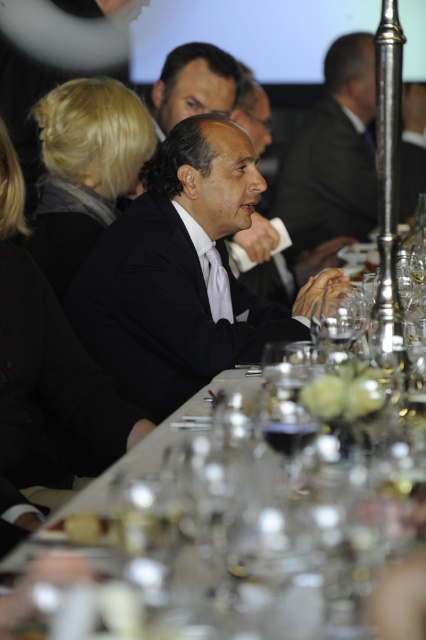
You are attending a formal event and notice two points on the table where you might place your drink. The first point is at coordinates point (296, 627) and the second is at point (198, 260). Which point is closer to you?

Point (296, 627) is closer to the viewer than point (198, 260).

You are sitting at a table in the back of the room and want to reach the clear glass table at center. There is a black satin suit at center blocking your path. Can you walk straight ahead to reach the table without moving around the obstruction?

The clear glass table at center is closer to the viewer than the black satin suit at center, so the table is actually in front of the suit. This means the black satin suit at center is between you and the table, so you cannot walk straight ahead to reach the table without moving around the obstruction.